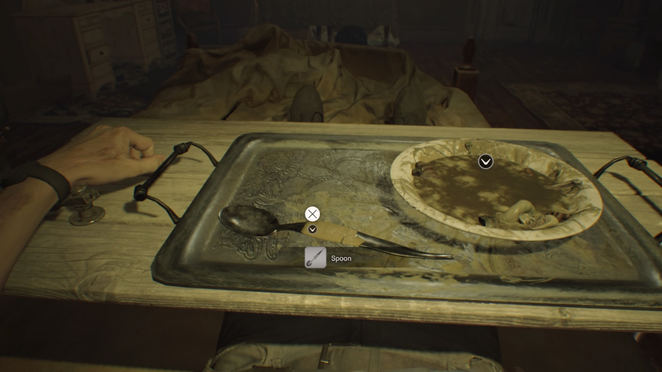
Find the location of a particular element. The width and height of the screenshot is (662, 372). wooden food board is located at coordinates (120, 232), (627, 190).